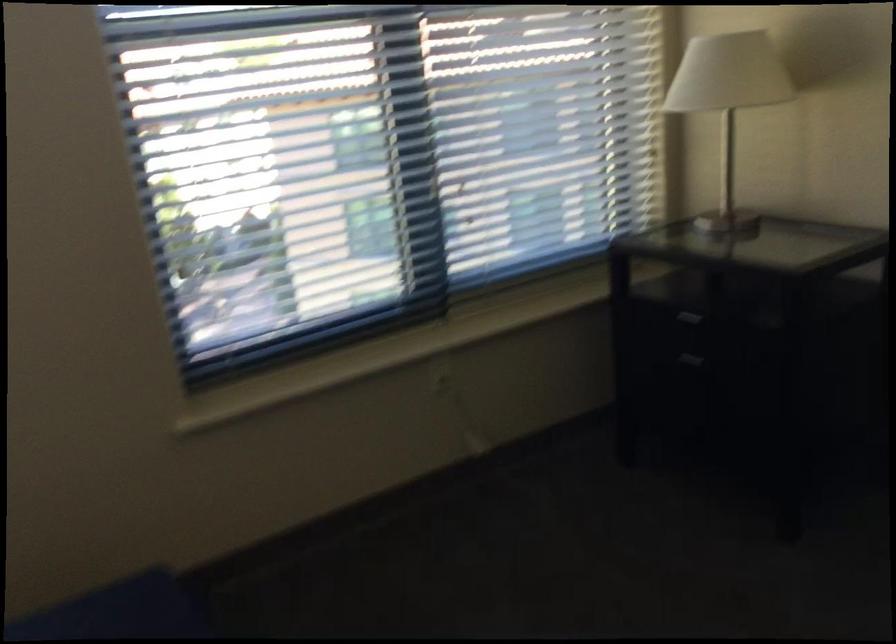
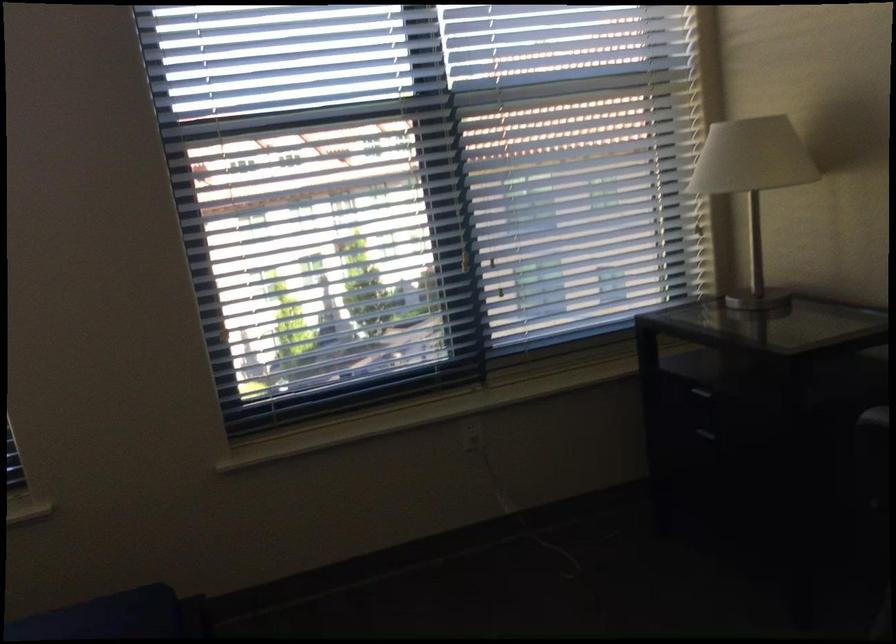
Question: The camera is either moving clockwise (left) or counter-clockwise (right) around the object. The first image is from the beginning of the video and the second image is from the end. Is the camera moving left or right when shooting the video?

Choices:
 (A) Left
 (B) Right

Answer: (B)